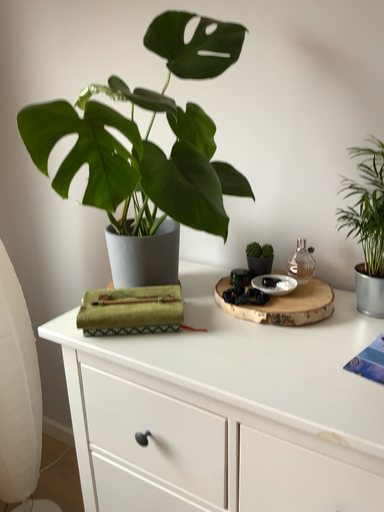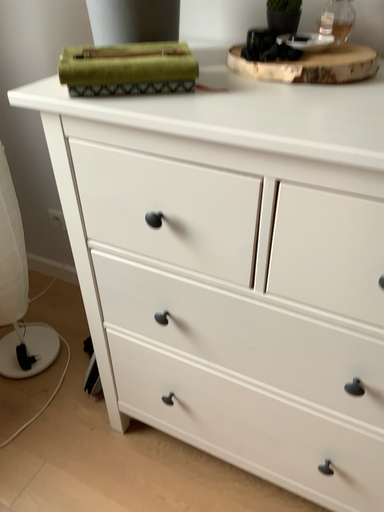
Question: How did the camera likely rotate when shooting the video?

Choices:
 (A) rotated downward
 (B) rotated upward

Answer: (A)